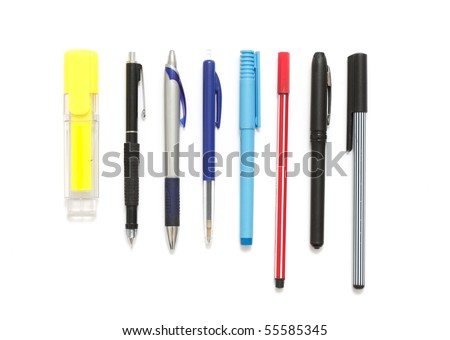
Where is `pen`? pen is located at coordinates (364, 89), (322, 89), (284, 78), (248, 87), (211, 98), (174, 100), (132, 107).